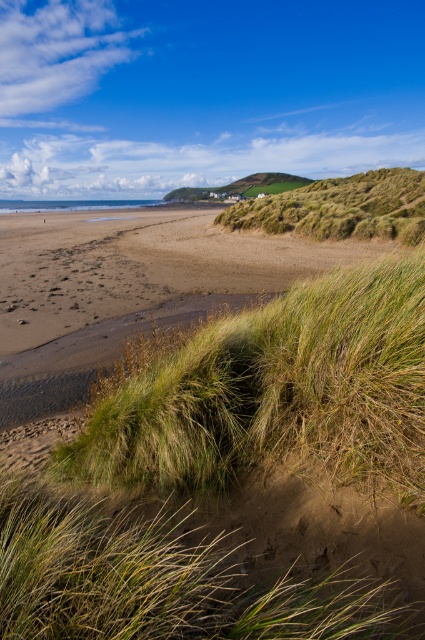
Question: Which object appears closest to the camera in this image?

Choices:
 (A) green grassy hill at upper right
 (B) brown sand at lower left
 (C) green grassy at lower left

Answer: (C)

Question: Which object is the farthest from the green grassy at lower left?

Choices:
 (A) brown sand at lower left
 (B) green grassy hill at upper right

Answer: (B)

Question: Can you confirm if green grassy at lower left is thinner than brown sand at lower left?

Choices:
 (A) yes
 (B) no

Answer: (A)

Question: Is the position of green grassy at lower left less distant than that of brown sand at lower left?

Choices:
 (A) yes
 (B) no

Answer: (A)

Question: Considering the real-world distances, which object is farthest from the green grassy at lower left?

Choices:
 (A) green grassy hill at upper right
 (B) brown sand at lower left

Answer: (A)

Question: Can you confirm if green grassy at lower left is positioned to the right of green grassy hill at upper right?

Choices:
 (A) yes
 (B) no

Answer: (B)